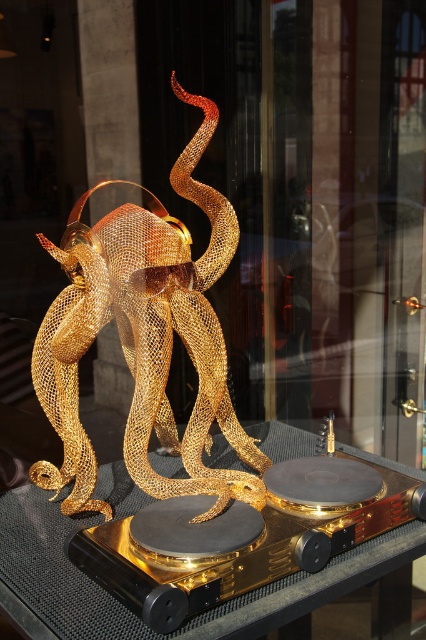
Question: Does gold mesh octopus at center come behind transparent glass table at center?

Choices:
 (A) no
 (B) yes

Answer: (B)

Question: Which object is closer to the camera taking this photo?

Choices:
 (A) gold mesh octopus at center
 (B) transparent glass table at center

Answer: (B)

Question: Does gold mesh octopus at center appear over transparent glass table at center?

Choices:
 (A) yes
 (B) no

Answer: (A)

Question: Which point appears farthest from the camera in this image?

Choices:
 (A) (94, 508)
 (B) (60, 545)

Answer: (A)

Question: In this image, where is gold mesh octopus at center located relative to transparent glass table at center?

Choices:
 (A) below
 (B) above

Answer: (B)